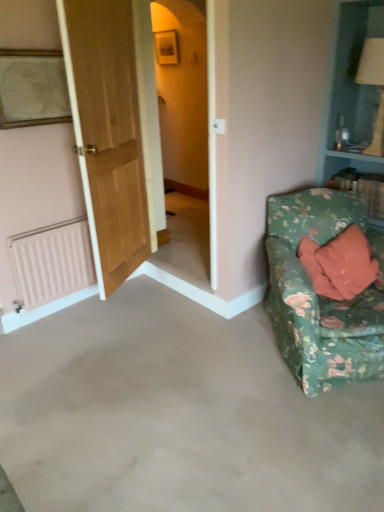
Question: Does wooden framed portrait at upper left appear on the left side of wooden door at left?

Choices:
 (A) no
 (B) yes

Answer: (B)

Question: Can you confirm if wooden framed portrait at upper left is bigger than wooden door at left?

Choices:
 (A) yes
 (B) no

Answer: (B)

Question: Does wooden framed portrait at upper left have a lesser height compared to wooden door at left?

Choices:
 (A) yes
 (B) no

Answer: (A)

Question: From the image's perspective, does wooden framed portrait at upper left appear higher than wooden door at left?

Choices:
 (A) yes
 (B) no

Answer: (A)

Question: From the image's perspective, would you say wooden framed portrait at upper left is shown under wooden door at left?

Choices:
 (A) yes
 (B) no

Answer: (B)

Question: From a real-world perspective, is gray carpet at lower right above or below wooden framed portrait at upper left?

Choices:
 (A) above
 (B) below

Answer: (B)

Question: Is gray carpet at lower right taller or shorter than wooden framed portrait at upper left?

Choices:
 (A) tall
 (B) short

Answer: (B)

Question: Is point (266, 391) positioned closer to the camera than point (31, 58)?

Choices:
 (A) farther
 (B) closer

Answer: (B)

Question: In the image, is gray carpet at lower right on the left side or the right side of wooden framed portrait at upper left?

Choices:
 (A) right
 (B) left

Answer: (A)

Question: Is wooden framed portrait at upper left in front of or behind floral fabric couch at lower right in the image?

Choices:
 (A) behind
 (B) front

Answer: (A)

Question: Does point (16, 84) appear closer or farther from the camera than point (359, 298)?

Choices:
 (A) closer
 (B) farther

Answer: (A)

Question: Based on their sizes in the image, would you say wooden framed portrait at upper left is bigger or smaller than floral fabric couch at lower right?

Choices:
 (A) small
 (B) big

Answer: (A)

Question: Considering the positions of wooden framed portrait at upper left and floral fabric couch at lower right in the image, is wooden framed portrait at upper left taller or shorter than floral fabric couch at lower right?

Choices:
 (A) short
 (B) tall

Answer: (A)

Question: Relative to floral fabric couch at lower right, is gray carpet at lower right in front or behind?

Choices:
 (A) behind
 (B) front

Answer: (B)

Question: Is point (289, 388) closer or farther from the camera than point (329, 361)?

Choices:
 (A) closer
 (B) farther

Answer: (B)